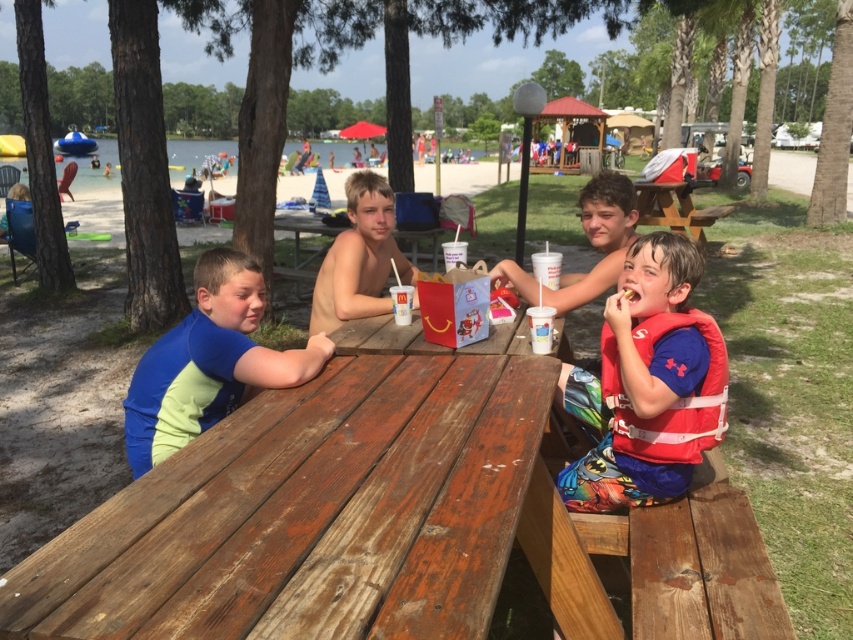
Question: Which object is the closest to the blue fabric shirt at left?

Choices:
 (A) smooth skin boy at center
 (B) weathered wood table at center

Answer: (B)

Question: Among these objects, which one is farthest from the camera?

Choices:
 (A) weathered wood table at center
 (B) blue fabric shirt at left
 (C) red life vest at right
 (D) smooth skin boy at center

Answer: (D)

Question: Which point appears closest to the camera in this image?

Choices:
 (A) (231, 358)
 (B) (318, 310)

Answer: (A)

Question: Is red life vest at right positioned behind smooth skin boy at center?

Choices:
 (A) no
 (B) yes

Answer: (A)

Question: Can you confirm if weathered wood table at center is thinner than blue fabric shirt at left?

Choices:
 (A) yes
 (B) no

Answer: (B)

Question: Is red life vest at right smaller than smooth skin boy at center?

Choices:
 (A) no
 (B) yes

Answer: (B)